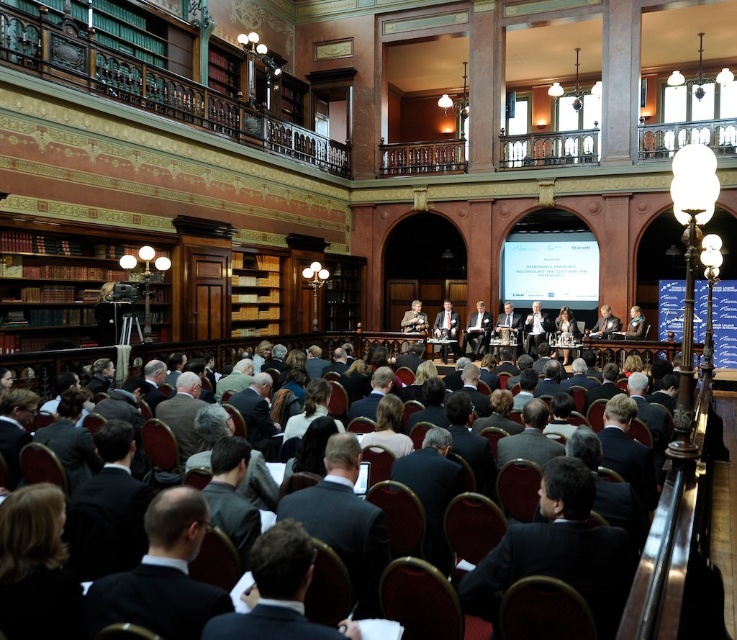
You are standing in the grand room and want to walk from point (475, 348) to point (439, 328). Which direction should you move in to get closer to your destination?

To move from point (475, 348) to point (439, 328), you should move backward since point (475, 348) is further away from the camera than point (439, 328).

You are an event organizer who needs to adjust the seating arrangement. If you want to move the light brown wood chair at center closer to the audience, which direction should you move it relative to the light brown wood podium at center?

The light brown wood podium at center is behind the light brown wood chair at center. To move the chair closer to the audience, you should move it forward away from the podium.

You are standing at the entrance of the grand room and want to approach the light brown wood podium at center. Based on the room layout, which direction should you head towards to reach it?

The light brown wood podium at center is located at point [447,326], so you should head towards the center of the room to reach it.